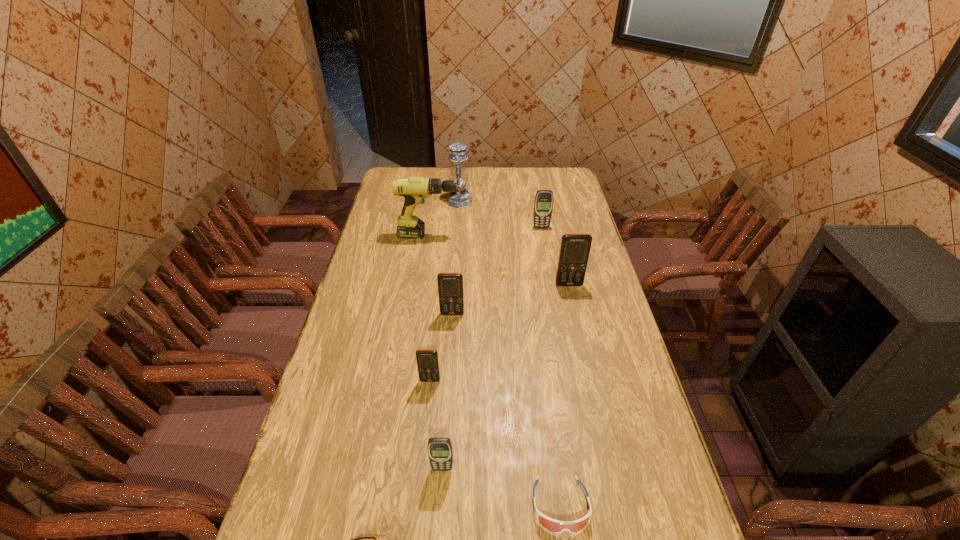
Where is `vacant space in between the seventh shortest object and the second nearest cellular telephone`? The width and height of the screenshot is (960, 540). vacant space in between the seventh shortest object and the second nearest cellular telephone is located at coordinates (499, 333).

I want to click on vacant space that's between the right gray cellular telephone and the second shortest object, so click(x=551, y=366).

Find the location of a particular element. This screenshot has height=540, width=960. free space between the lantern and the third nearest cellular telephone is located at coordinates (456, 257).

Identify the location of vacant area between the third nearest object and the second nearest cellular telephone. This screenshot has height=540, width=960. (436, 424).

Locate an element on the screen. unoccupied position between the smallest orange cellular telephone and the farthest orange cellular telephone is located at coordinates (499, 333).

Identify the location of free spot between the second nearest orange cellular telephone and the lantern. Image resolution: width=960 pixels, height=540 pixels. (456, 257).

The image size is (960, 540). Identify the location of free space that is in between the taller goggles and the smaller gray cellular telephone. (501, 487).

Locate which object ranks sixth in proximity to the shortest object. Please provide its 2D coordinates. Your answer should be formatted as a tuple, i.e. [(x, y)], where the tuple contains the x and y coordinates of a point satisfying the conditions above.

[(414, 189)]

Point out which object is positioned as the third nearest to the rightmost orange cellular telephone. Please provide its 2D coordinates. Your answer should be formatted as a tuple, i.e. [(x, y)], where the tuple contains the x and y coordinates of a point satisfying the conditions above.

[(414, 189)]

At what (x,y) coordinates should I click in order to perform the action: click on cellular telephone that is the second closest one to the biggest orange cellular telephone. Please return your answer as a coordinate pair (x, y). This screenshot has height=540, width=960. Looking at the image, I should click on (450, 285).